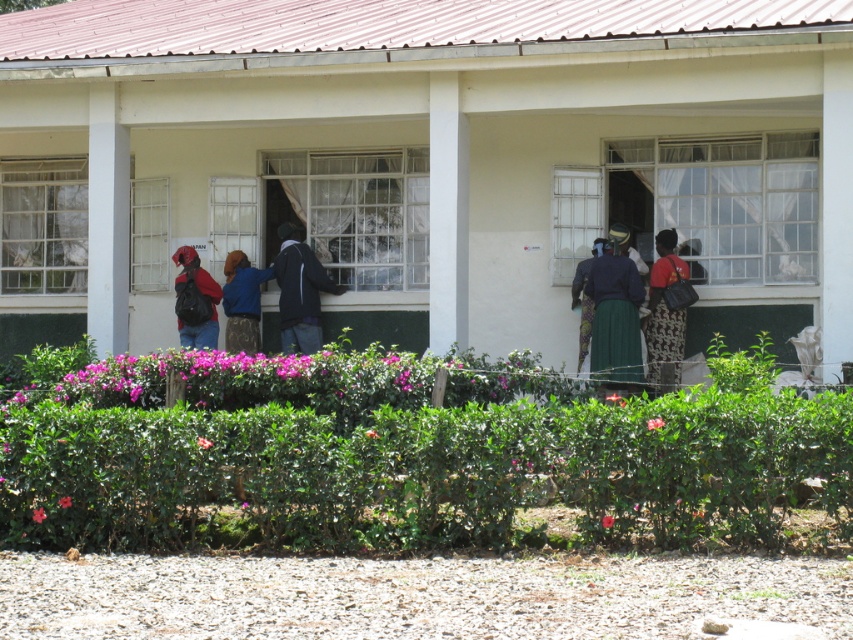
You are standing in front of the building and want to place a new potted plant between the dark blue jacket at center and the matte black backpack at left. Based on their positions, which object should the plant be closer to?

The dark blue jacket at center is positioned on the right side of matte black backpack at left, so the plant should be placed closer to the matte black backpack at left to be between them.

You are standing in front of the building and want to know which object is taller between the green leafy hedge at center and the blue fabric jacket at center. Which one is taller?

The blue fabric jacket at center is taller than the green leafy hedge at center.

Based on the photo, you are standing at the point with coordinates point (78, 376). You want to walk towards the point with coordinates point (596, 244). Which direction should you move relative to the building?

You should move towards the building because point (78, 376) is in front of point (596, 244), meaning the latter is closer to the building.